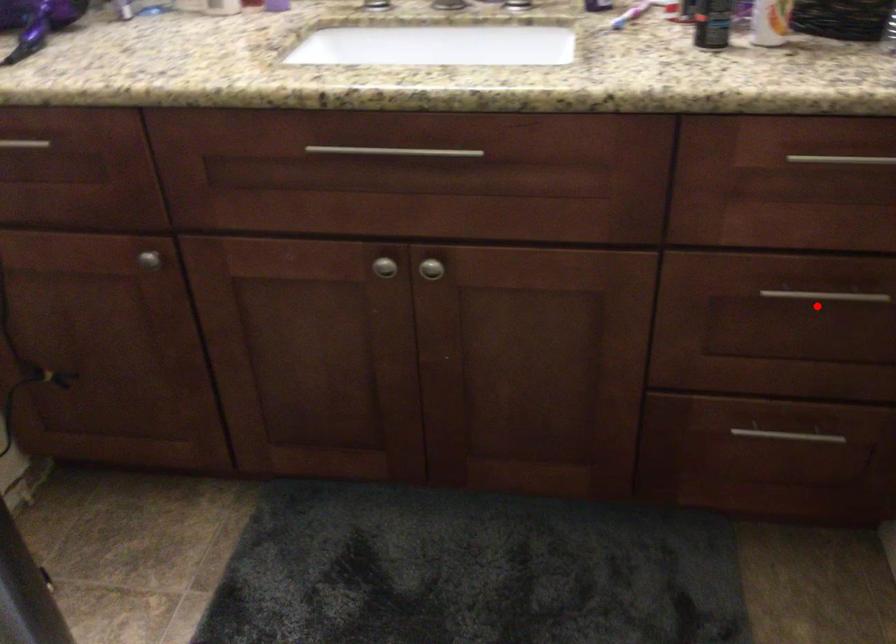
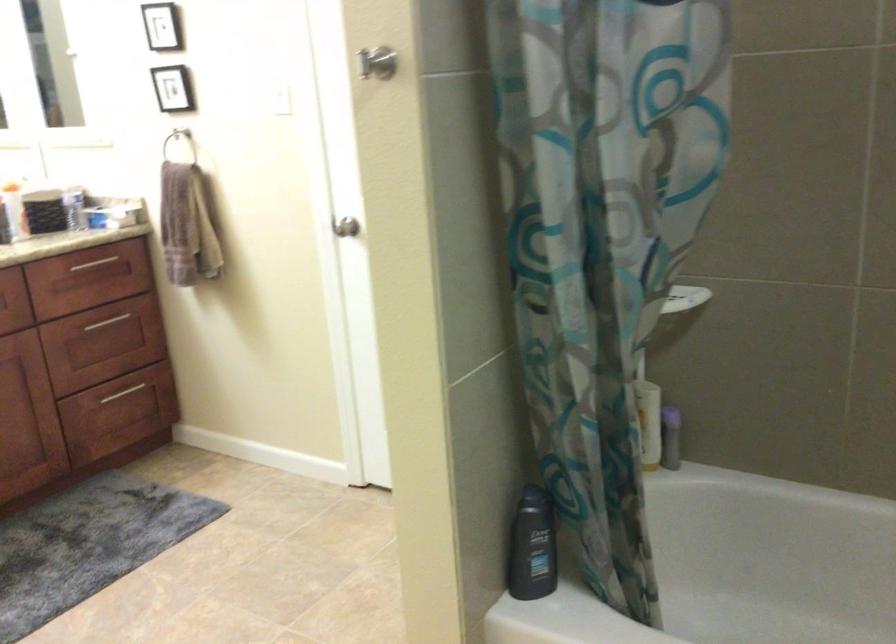
In the second image, find the point that corresponds to the highlighted location in the first image.

(115, 323)